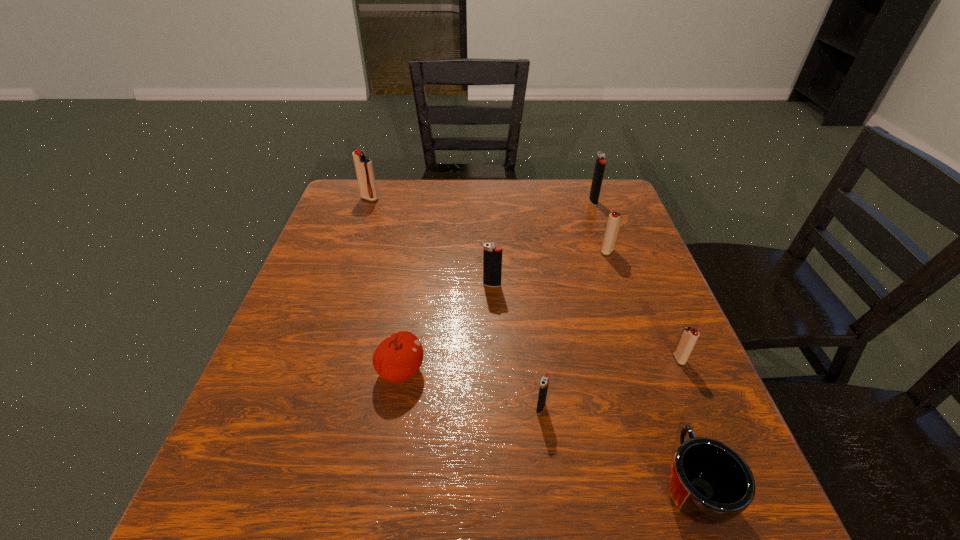
Locate an element on the screen. This screenshot has height=540, width=960. igniter identified as the fourth closest to the third nearest igniter is located at coordinates (600, 163).

Locate an element on the screen. This screenshot has width=960, height=540. red igniter that is the nearest to the smallest red igniter is located at coordinates (614, 221).

At what (x,y) coordinates should I click in order to perform the action: click on the second closest red igniter relative to the second red igniter from left to right. Please return your answer as a coordinate pair (x, y). The image size is (960, 540). Looking at the image, I should click on (364, 169).

Where is `black igniter that can be found as the third closest to the leftmost igniter`? The width and height of the screenshot is (960, 540). black igniter that can be found as the third closest to the leftmost igniter is located at coordinates (544, 383).

Select which black igniter is the third closest to the farthest red igniter. Please provide its 2D coordinates. Your answer should be formatted as a tuple, i.e. [(x, y)], where the tuple contains the x and y coordinates of a point satisfying the conditions above.

[(544, 383)]

Identify the location of free location that satisfies the following two spatial constraints: 1. on the front side of the nearest red igniter; 2. on the left side of the farthest red igniter. The width and height of the screenshot is (960, 540). (315, 359).

The height and width of the screenshot is (540, 960). Identify the location of free space that satisfies the following two spatial constraints: 1. on the back side of the red apple; 2. on the left side of the third farthest igniter. (420, 251).

You are a GUI agent. You are given a task and a screenshot of the screen. Output one action in this format:
    pyautogui.click(x=<x>, y=<y>)
    Task: Click on the vacant region that satisfies the following two spatial constraints: 1. on the back side of the second red igniter from right to left; 2. on the left side of the fourth farthest igniter
    The width and height of the screenshot is (960, 540).
    Given the screenshot: What is the action you would take?
    pyautogui.click(x=492, y=251)

Find the location of a particular element. This screenshot has width=960, height=540. free region that satisfies the following two spatial constraints: 1. on the side of the rightmost black igniter with the handle; 2. on the left side of the red mug is located at coordinates (592, 201).